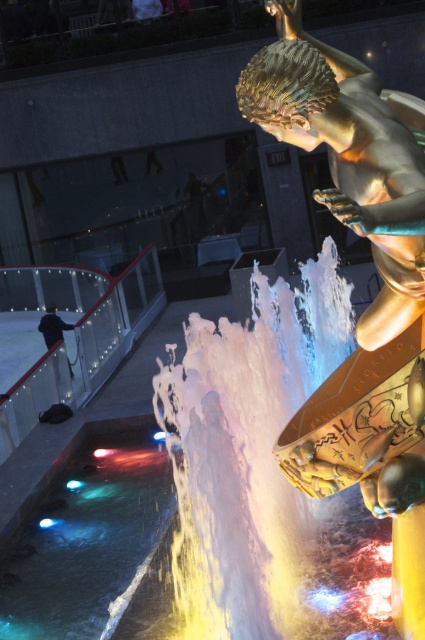
You are standing in the public space where the fountain is located. You see the translucent glass water at lower left and the dark blue fabric jacket at left. Which object is positioned more to the right side?

The translucent glass water at lower left is positioned more to the right side than the dark blue fabric jacket at left.

You are standing in front of the fountain and want to touch both the gold metallic statue at center and the dark blue fabric jacket at left. Which object should you reach for first to touch the one closer to you?

You should reach for the gold metallic statue at center first because it is closer to you than the dark blue fabric jacket at left.